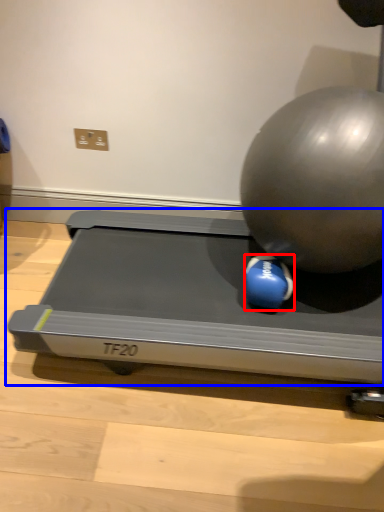
Question: Among these objects, which one is nearest to the camera, ball (highlighted by a red box) or treadmill (highlighted by a blue box)?

Choices:
 (A) ball
 (B) treadmill

Answer: (B)